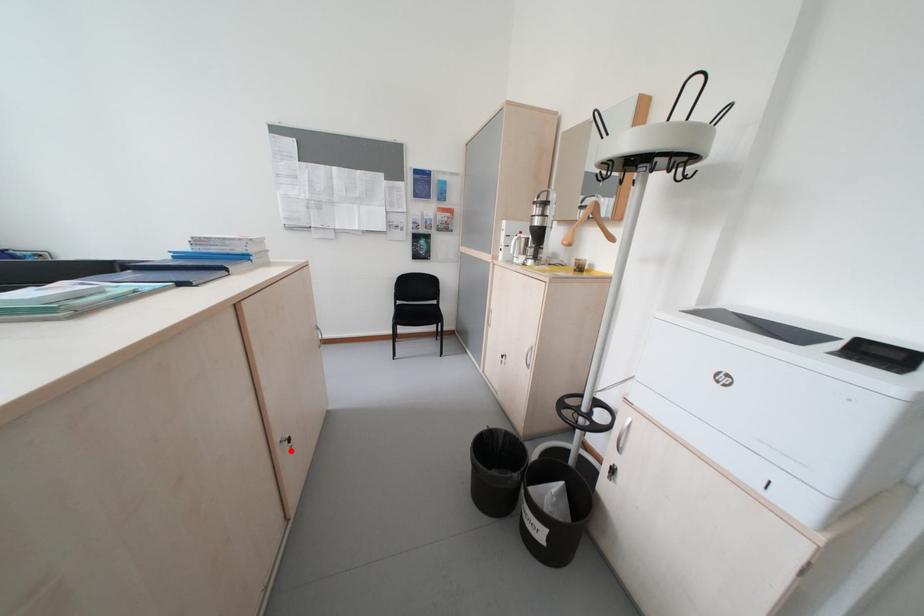
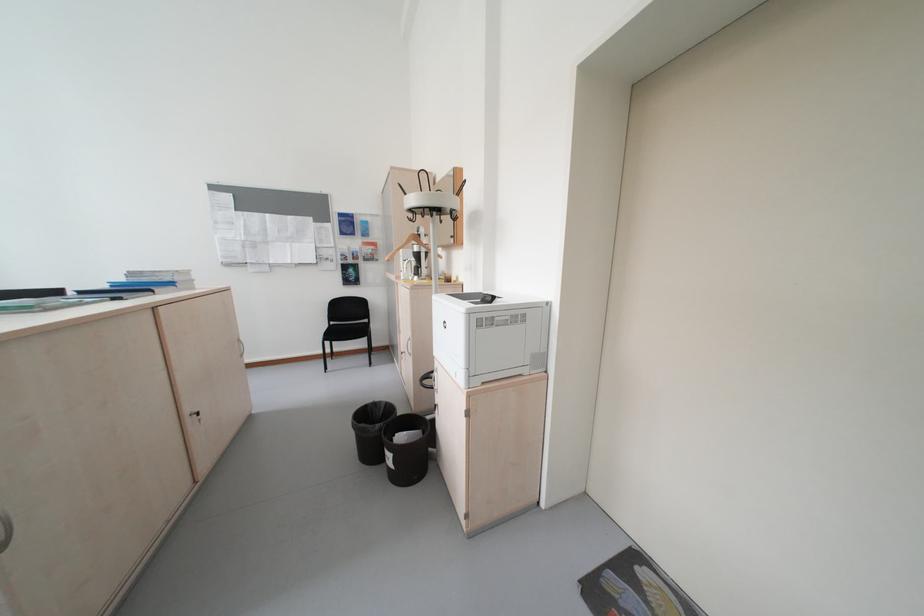
Where in the second image is the point corresponding to the highlighted location from the first image?

(200, 421)